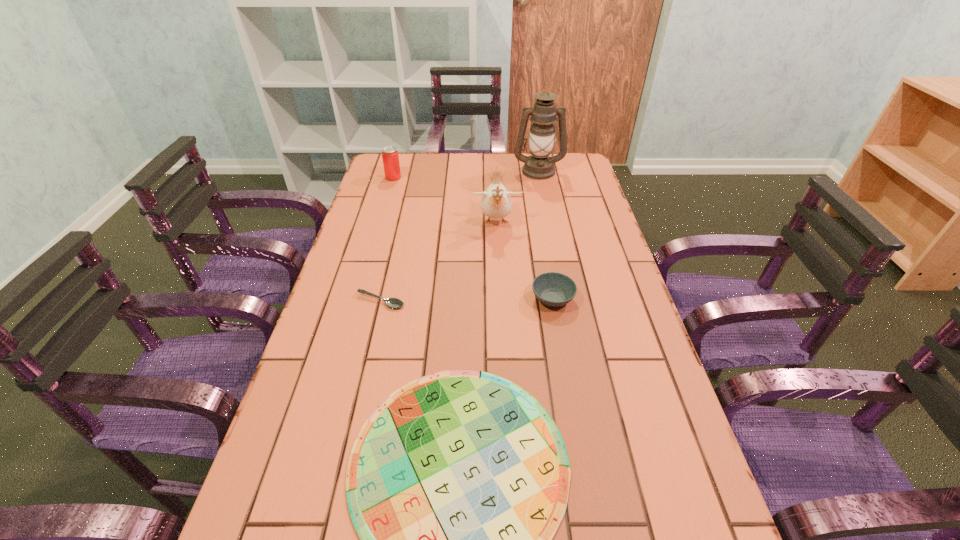
This screenshot has height=540, width=960. In order to click on free point between the second shortest object and the soup bowl in this screenshot , I will do `click(467, 300)`.

Identify which object is the second closest to the fourth shortest object. Please provide its 2D coordinates. Your answer should be formatted as a tuple, i.e. [(x, y)], where the tuple contains the x and y coordinates of a point satisfying the conditions above.

[(538, 165)]

Locate which object is the closest to the nearest object. Please provide its 2D coordinates. Your answer should be formatted as a tuple, i.e. [(x, y)], where the tuple contains the x and y coordinates of a point satisfying the conditions above.

[(553, 289)]

Locate an element on the screen. free spot that satisfies the following two spatial constraints: 1. on the front side of the fourth tallest object; 2. on the left side of the third tallest object is located at coordinates (358, 299).